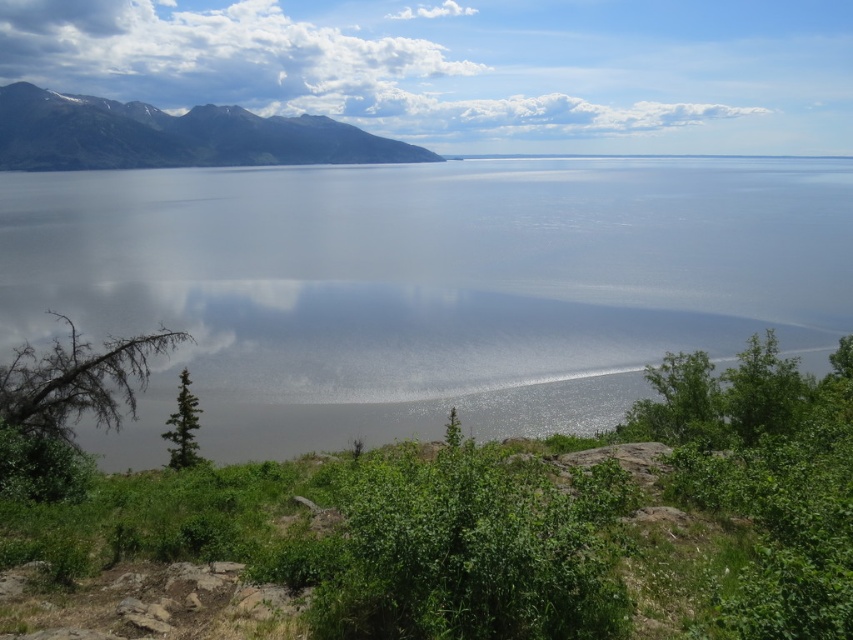
Question: Which of the following is the farthest from the observer?

Choices:
 (A) rocky brown mountain at upper left
 (B) white fluffy cloud at upper left

Answer: (B)

Question: Can you confirm if white fluffy cloud at upper left is positioned to the left of rocky brown mountain at upper left?

Choices:
 (A) yes
 (B) no

Answer: (A)

Question: Based on their relative distances, which object is farther from the glistening water at center?

Choices:
 (A) white fluffy cloud at upper center
 (B) white fluffy cloud at upper left
 (C) rocky brown mountain at upper left

Answer: (B)

Question: Can you confirm if glistening water at center is bigger than rocky brown mountain at upper left?

Choices:
 (A) yes
 (B) no

Answer: (B)

Question: Which of these objects is positioned closest to the white fluffy cloud at upper center?

Choices:
 (A) white fluffy cloud at upper left
 (B) glistening water at center
 (C) rocky brown mountain at upper left

Answer: (A)

Question: Where is white fluffy cloud at upper center located in relation to white fluffy cloud at upper left in the image?

Choices:
 (A) below
 (B) above

Answer: (A)